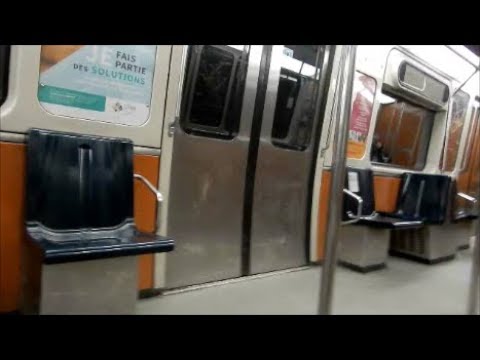
Where is `seat`? The width and height of the screenshot is (480, 360). seat is located at coordinates (x=366, y=232).